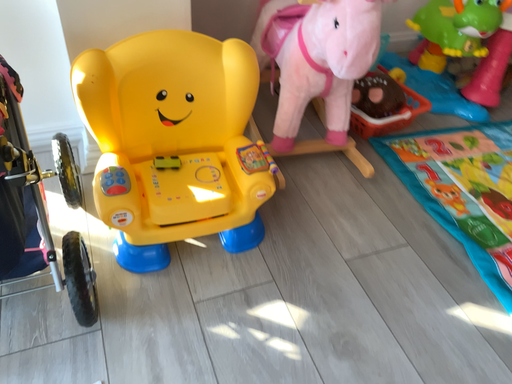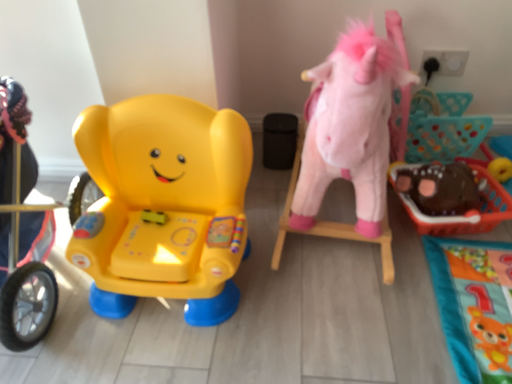
Question: Which way did the camera rotate in the video?

Choices:
 (A) rotated right
 (B) rotated left

Answer: (B)